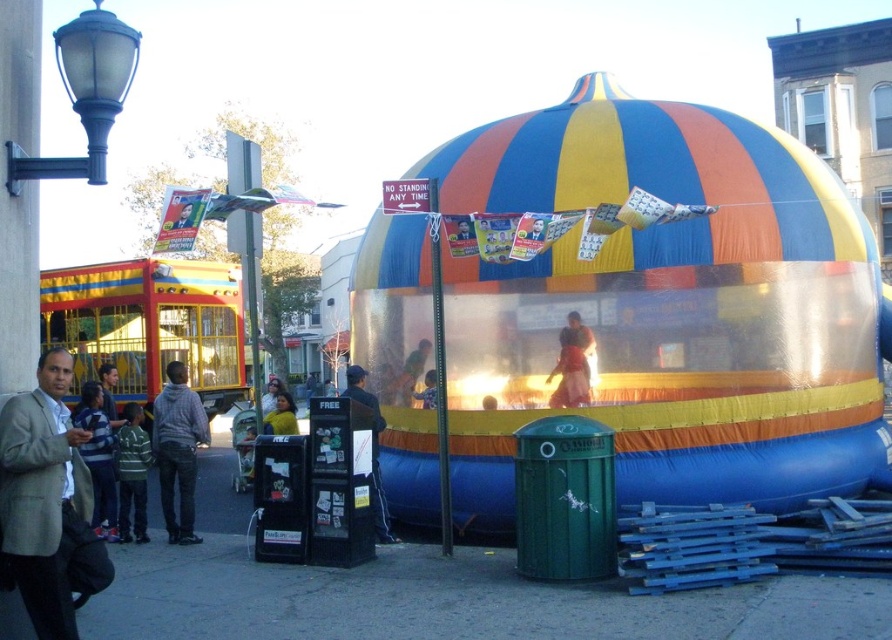
Between point (37, 570) and point (200, 412), which one is positioned behind?

The point (200, 412) is more distant.

Does light beige suit at lower left have a lesser width compared to gray hoodie at left?

In fact, light beige suit at lower left might be wider than gray hoodie at left.

Which is in front, point (48, 442) or point (205, 420)?

Point (48, 442) is in front.

You are a GUI agent. You are given a task and a screenshot of the screen. Output one action in this format:
    pyautogui.click(x=<x>, y=<y>)
    Task: Click on the light beige suit at lower left
    
    Given the screenshot: What is the action you would take?
    pyautogui.click(x=43, y=496)

In the scene shown: Which is above, striped sweater at left or dark blue jeans at center?

dark blue jeans at center is above.

Between point (100, 468) and point (356, 372), which one is positioned behind?

Point (356, 372)

This screenshot has width=892, height=640. What are the coordinates of `striped sweater at left` in the screenshot? It's located at (98, 456).

From the picture: Can you confirm if smooth concrete pavement at lower center is positioned to the left of light beige suit at lower left?

In fact, smooth concrete pavement at lower center is to the right of light beige suit at lower left.

Does smooth concrete pavement at lower center have a lesser height compared to light beige suit at lower left?

Indeed, smooth concrete pavement at lower center has a lesser height compared to light beige suit at lower left.

The image size is (892, 640). Identify the location of smooth concrete pavement at lower center. (431, 593).